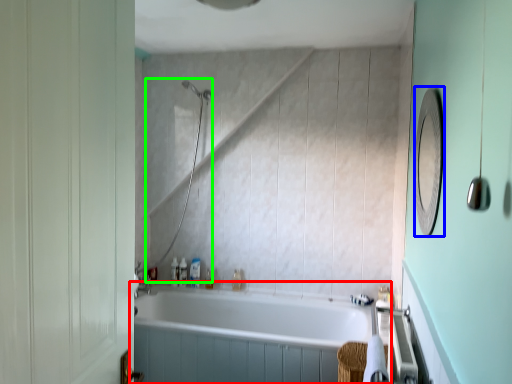
Question: Estimate the real-world distances between objects in this image. Which object is farther from bathtub (highlighted by a red box), mirror (highlighted by a blue box) or shower (highlighted by a green box)?

Choices:
 (A) mirror
 (B) shower

Answer: (A)